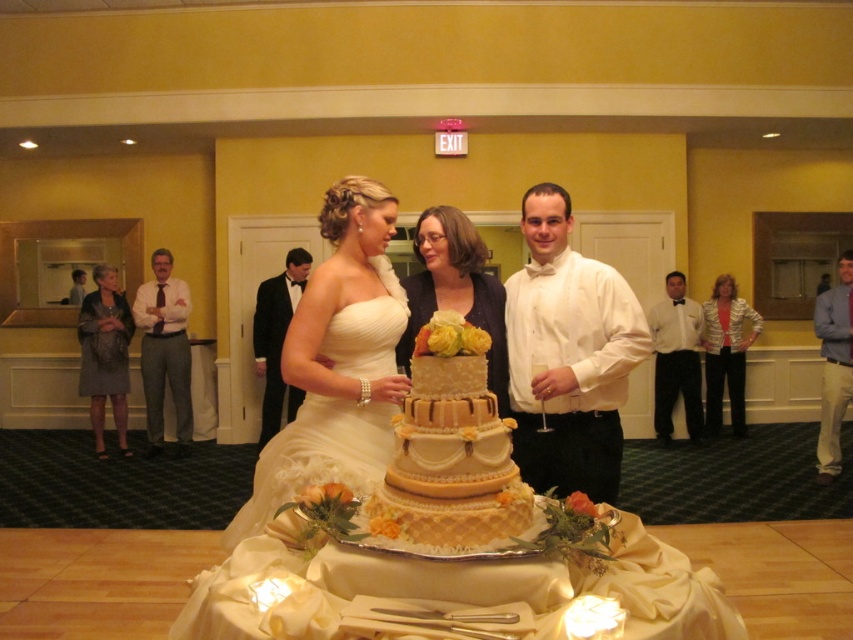
You are a photographer at the wedding and need to capture a photo of both the shiny gold jacket at center and the black satin suit at center. Which one should you focus on first if you want to ensure both are in frame without moving the camera?

You should focus on the shiny gold jacket at center first because it is wider than the black satin suit at center, ensuring it fits within the frame before adjusting for the narrower suit.

You are a photographer at a wedding. You need to capture a photo of the beige fondant cake at center and the matte gold dress at center. Which object is closer to the camera?

The matte gold dress at center is closer to the camera because the beige fondant cake at center is positioned under it.

You are a photographer at the wedding and need to capture a photo of both the beige fondant cake at center and the matte gray dress at left. Based on their heights, which one should you focus on first to ensure both are fully visible in the frame?

The beige fondant cake at center is shorter than the matte gray dress at left, so you should focus on the matte gray dress at left first to ensure its full height is captured before adjusting the frame to include the shorter cake.